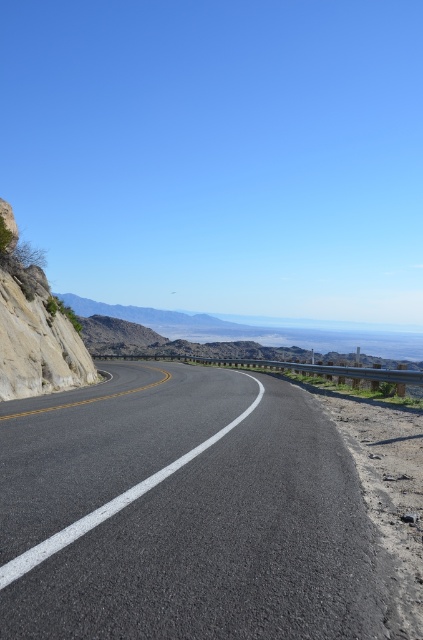
Does black asphalt road at center lie behind rocky cliff at left?

That is False.

Which of these two, black asphalt road at center or rocky cliff at left, stands shorter?

Standing shorter between the two is black asphalt road at center.

Describe the element at coordinates (183, 513) in the screenshot. I see `black asphalt road at center` at that location.

This screenshot has height=640, width=423. What are the coordinates of `black asphalt road at center` in the screenshot? It's located at (183, 513).